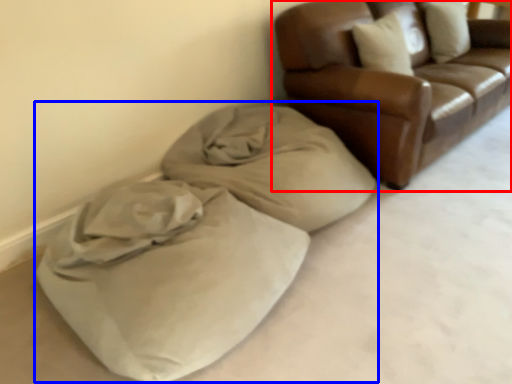
Question: Which of the following is the farthest to the observer, studio couch (highlighted by a red box) or bean bag chair (highlighted by a blue box)?

Choices:
 (A) studio couch
 (B) bean bag chair

Answer: (A)